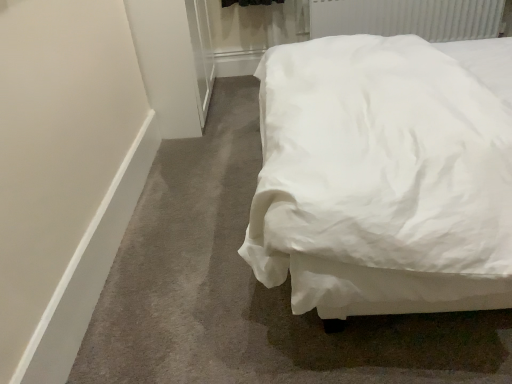
What is the approximate width of white textured radiator at upper right?

5.09 inches.

The width and height of the screenshot is (512, 384). Identify the location of white textured radiator at upper right. (407, 18).

Describe the element at coordinates (407, 18) in the screenshot. Image resolution: width=512 pixels, height=384 pixels. I see `white textured radiator at upper right` at that location.

You are a GUI agent. You are given a task and a screenshot of the screen. Output one action in this format:
    pyautogui.click(x=<x>, y=<y>)
    Task: Click on the white textured radiator at upper right
    The width and height of the screenshot is (512, 384).
    Given the screenshot: What is the action you would take?
    pyautogui.click(x=407, y=18)